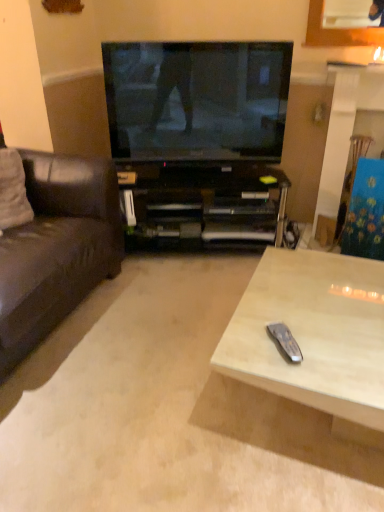
At what (x,y) coordinates should I click in order to perform the action: click on free point in front of silver metallic remote at lower right. Please return your answer as a coordinate pair (x, y). The width and height of the screenshot is (384, 512). Looking at the image, I should click on (302, 381).